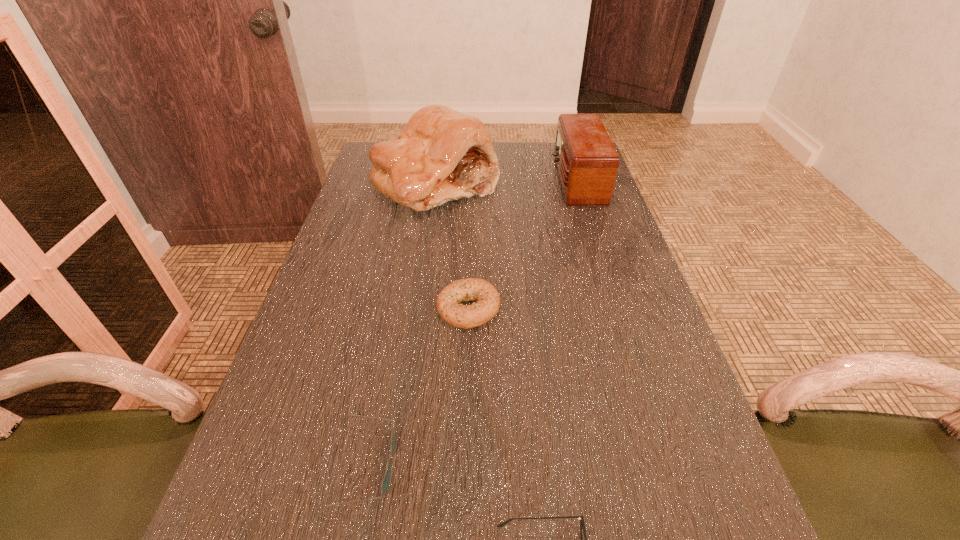
Find the location of a particular element. the tallest object is located at coordinates (441, 155).

Locate an element on the screen. radio receiver is located at coordinates (587, 162).

Identify the location of the fourth shortest object. The image size is (960, 540). (587, 162).

Where is `the third farthest object`? the third farthest object is located at coordinates (487, 306).

Locate an element on the screen. the second nearest object is located at coordinates (385, 485).

This screenshot has height=540, width=960. Find the location of `vacant position located on the filling side of the bread`. vacant position located on the filling side of the bread is located at coordinates (424, 258).

Find the location of a particular element. free location located 0.160m on the front-facing side of the rightmost object is located at coordinates (503, 180).

Identify the location of free spot located on the front-facing side of the rightmost object. The image size is (960, 540). (533, 180).

The width and height of the screenshot is (960, 540). In order to click on vacant space situated 0.370m on the front-facing side of the rightmost object in this screenshot , I will do `click(436, 180)`.

The height and width of the screenshot is (540, 960). Identify the location of vacant area situated 0.260m on the back of the bagel. (470, 222).